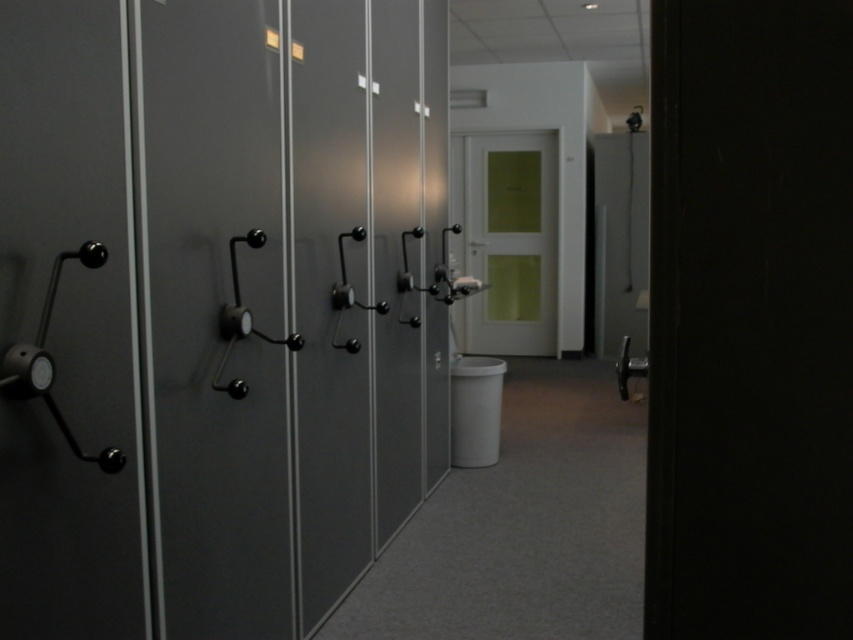
You are standing in the hallway and need to place a large box between the matte black cabinet at left and the matte green door at center. Can you fit it there?

The matte black cabinet at left is to the left of the matte green door at center, so there is space between them. However, the exact width of the space isn t specified, so it s uncertain if the large box will fit without more information.

You are trying to open the matte green door at center but notice the matte black door handle at left. Is the handle part of the door or a separate object?

The matte black door handle at left is in front of matte green door at center, so it is part of the door.

You are trying to open the matte green door at center but notice the matte black door handle at left. Based on their sizes, can you estimate if the handle is large enough to grip comfortably?

The matte black door handle at left occupies less space than the matte green door at center, so it may be smaller and harder to grip comfortably.